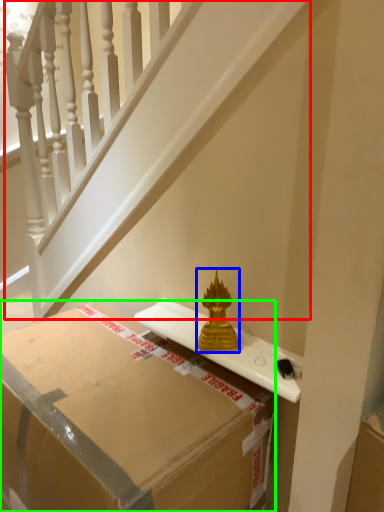
Question: Based on their relative distances, which object is farther from stairwell (highlighted by a red box)? Choose from sculpture (highlighted by a blue box) and box (highlighted by a green box).

Choices:
 (A) sculpture
 (B) box

Answer: (A)